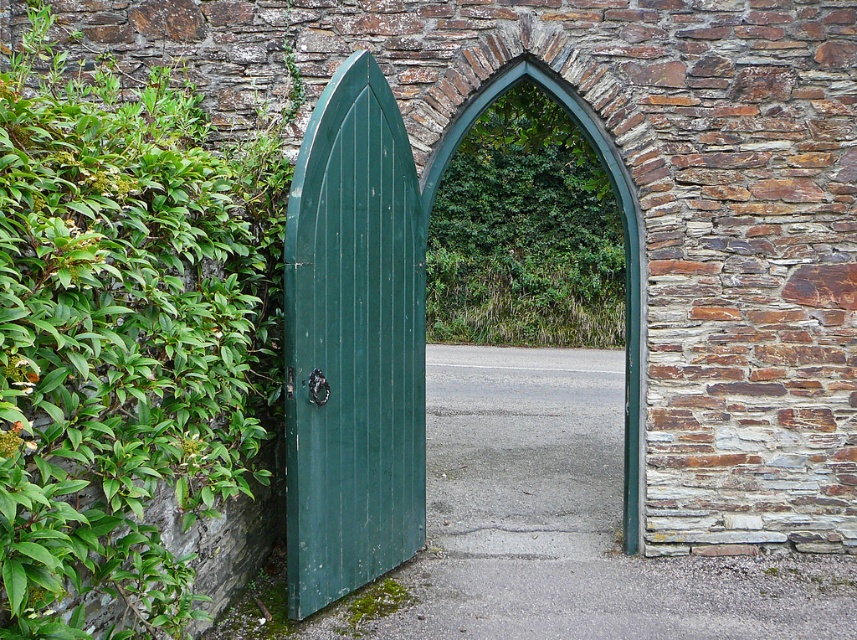
Question: Which object appears closest to the camera in this image?

Choices:
 (A) green leafy vegetation at center
 (B) green wooden door at center

Answer: (B)

Question: Does green wooden door at center have a lesser width compared to green leafy vegetation at center?

Choices:
 (A) yes
 (B) no

Answer: (A)

Question: Which object is farther from the camera taking this photo?

Choices:
 (A) green wooden door at center
 (B) green leafy vegetation at center

Answer: (B)

Question: Can you confirm if green wooden door at center is positioned above green leafy vegetation at center?

Choices:
 (A) yes
 (B) no

Answer: (B)

Question: Does green wooden door at center have a greater width compared to green leafy vegetation at center?

Choices:
 (A) no
 (B) yes

Answer: (A)